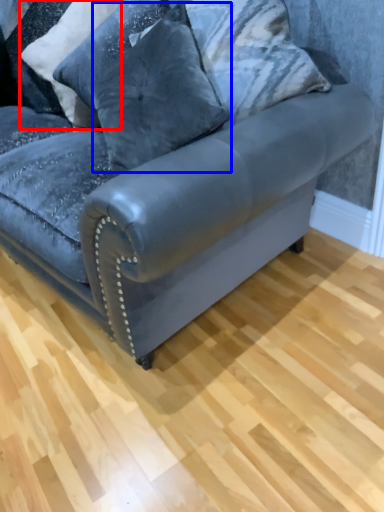
Question: Which object is further to the camera taking this photo, pillow (highlighted by a red box) or pillow (highlighted by a blue box)?

Choices:
 (A) pillow
 (B) pillow

Answer: (A)